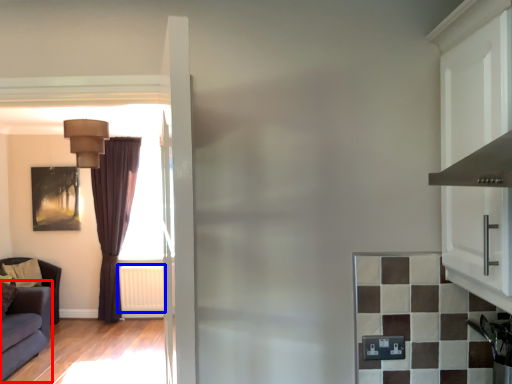
Question: Among these objects, which one is nearest to the camera, studio couch (highlighted by a red box) or radiator (highlighted by a blue box)?

Choices:
 (A) studio couch
 (B) radiator

Answer: (A)